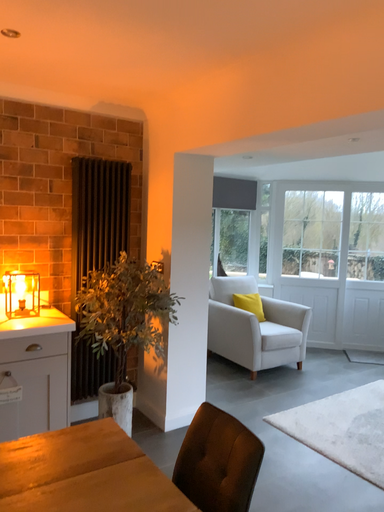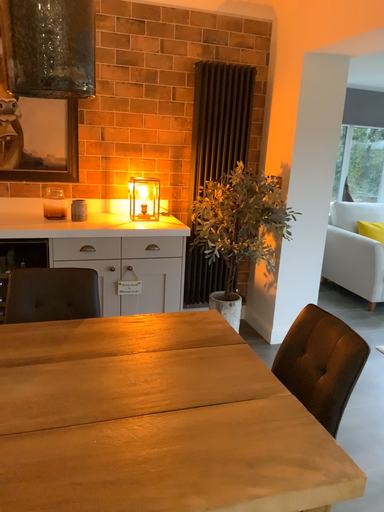
Question: How did the camera likely rotate when shooting the video?

Choices:
 (A) rotated right
 (B) rotated left

Answer: (B)